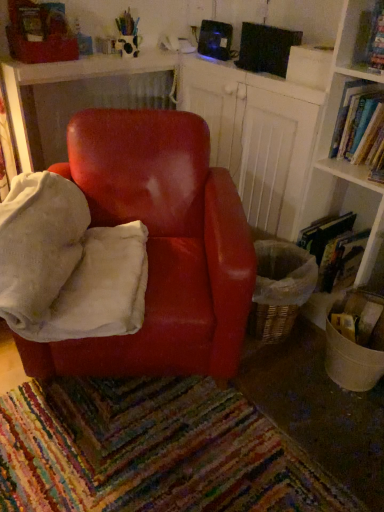
Question: From a real-world perspective, does velvety white bean bag at center sit lower than glossy leather chair at center?

Choices:
 (A) no
 (B) yes

Answer: (A)

Question: Is velvety white bean bag at center thinner than glossy leather chair at center?

Choices:
 (A) no
 (B) yes

Answer: (B)

Question: Does velvety white bean bag at center come behind glossy leather chair at center?

Choices:
 (A) no
 (B) yes

Answer: (A)

Question: From the image's perspective, is velvety white bean bag at center located beneath glossy leather chair at center?

Choices:
 (A) no
 (B) yes

Answer: (A)

Question: Is glossy leather chair at center completely or partially inside velvety white bean bag at center?

Choices:
 (A) yes
 (B) no

Answer: (B)

Question: Based on their sizes in the image, would you say glossy wood table at center is bigger or smaller than hardcover book at upper right, positioned as the first book in top-to-bottom order?

Choices:
 (A) big
 (B) small

Answer: (A)

Question: Is glossy wood table at center situated inside hardcover book at upper right, which ranks as the 2th book in bottom-to-top order, or outside?

Choices:
 (A) inside
 (B) outside

Answer: (B)

Question: From the image's perspective, is glossy wood table at center located above or below hardcover book at upper right, positioned as the first book in top-to-bottom order?

Choices:
 (A) below
 (B) above

Answer: (B)

Question: Is point tap(34, 89) positioned closer to the camera than point tap(355, 120)?

Choices:
 (A) closer
 (B) farther

Answer: (B)

Question: Is velvety white bean bag at center situated inside hardcover book at upper right, positioned as the first book in top-to-bottom order, or outside?

Choices:
 (A) inside
 (B) outside

Answer: (B)

Question: Is velvety white bean bag at center to the left or to the right of hardcover book at upper right, positioned as the first book in top-to-bottom order, in the image?

Choices:
 (A) right
 (B) left

Answer: (B)

Question: Relative to hardcover book at upper right, positioned as the first book in top-to-bottom order, is velvety white bean bag at center in front or behind?

Choices:
 (A) front
 (B) behind

Answer: (A)

Question: Is velvety white bean bag at center taller or shorter than hardcover book at upper right, which ranks as the 2th book in bottom-to-top order?

Choices:
 (A) short
 (B) tall

Answer: (B)

Question: Based on their sizes in the image, would you say velvety white bean bag at center is bigger or smaller than glossy wood table at center?

Choices:
 (A) small
 (B) big

Answer: (B)

Question: In the image, is velvety white bean bag at center positioned in front of or behind glossy wood table at center?

Choices:
 (A) front
 (B) behind

Answer: (A)